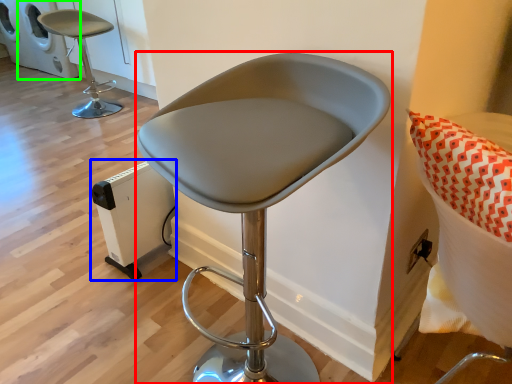
Question: Which object is the farthest from chair (highlighted by a red box)? Choose among these: appliance (highlighted by a blue box) or appliance (highlighted by a green box).

Choices:
 (A) appliance
 (B) appliance

Answer: (B)